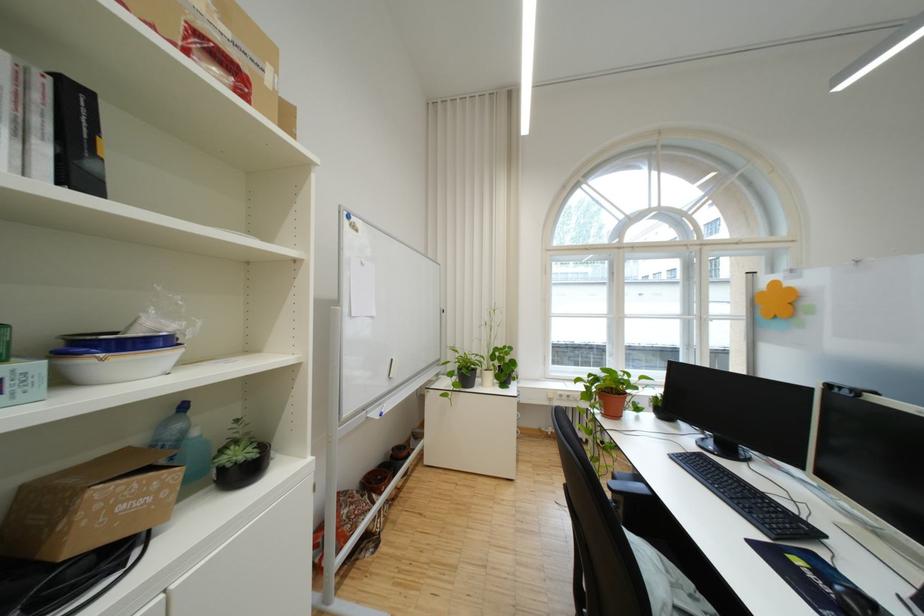
At what (x,y) coordinates should I click in order to perform the action: click on small cardboard box. Please return your answer as a coordinate pair (x, y). Image resolution: width=924 pixels, height=616 pixels. Looking at the image, I should click on (91, 505).